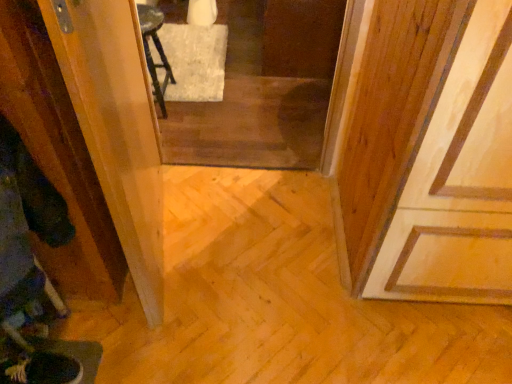
Question: Visually, is transparent plastic screen door at left, placed as the 2th screen door when sorted from right to left, positioned to the left or to the right of transparent glass screen door at center, the 2th screen door positioned from the front?

Choices:
 (A) right
 (B) left

Answer: (B)

Question: Considering the positions of transparent plastic screen door at left, the second screen door in the back-to-front sequence, and transparent glass screen door at center, arranged as the second screen door when viewed from the left, in the image, is transparent plastic screen door at left, the second screen door in the back-to-front sequence, wider or thinner than transparent glass screen door at center, arranged as the second screen door when viewed from the left,?

Choices:
 (A) wide
 (B) thin

Answer: (B)

Question: Considering their positions, is transparent plastic screen door at left, arranged as the 1th screen door when viewed from the left, located in front of or behind transparent glass screen door at center, which is the first screen door from back to front?

Choices:
 (A) front
 (B) behind

Answer: (A)

Question: Would you say transparent glass screen door at center, the 2th screen door positioned from the front, is to the left or to the right of transparent plastic screen door at left, arranged as the 1th screen door when viewed from the left, in the picture?

Choices:
 (A) right
 (B) left

Answer: (A)

Question: Which is correct: transparent glass screen door at center, which is the first screen door from back to front, is inside transparent plastic screen door at left, the second screen door in the back-to-front sequence, or outside of it?

Choices:
 (A) inside
 (B) outside

Answer: (B)

Question: Considering their positions, is transparent glass screen door at center, which is the first screen door from back to front, located in front of or behind transparent plastic screen door at left, arranged as the 1th screen door when viewed from the left?

Choices:
 (A) front
 (B) behind

Answer: (B)

Question: Based on their sizes in the image, would you say transparent glass screen door at center, the 1th screen door viewed from the right, is bigger or smaller than transparent plastic screen door at left, arranged as the 1th screen door when viewed from the left?

Choices:
 (A) big
 (B) small

Answer: (A)